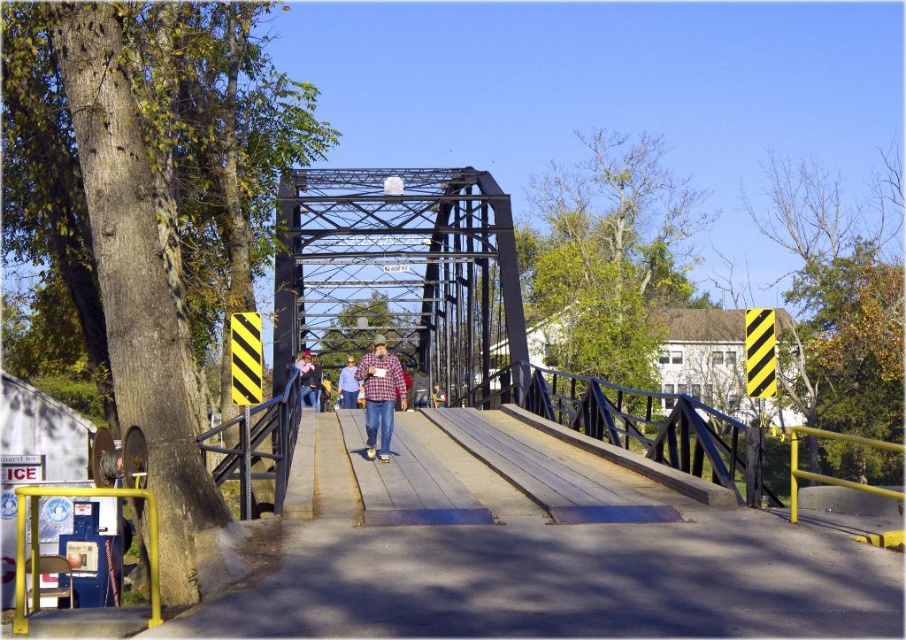
Question: Which object appears farthest from the camera in this image?

Choices:
 (A) matte pink shirt at center
 (B) plaid fabric shirt at center
 (C) black metal bridge at center
 (D) denim jacket at center

Answer: (A)

Question: Which object is positioned farthest from the denim jacket at center?

Choices:
 (A) matte pink shirt at center
 (B) black metal bridge at center
 (C) plaid fabric shirt at center

Answer: (B)

Question: Which object appears closest to the camera in this image?

Choices:
 (A) denim jacket at center
 (B) black metal bridge at center

Answer: (B)

Question: Does matte pink shirt at center have a greater width compared to denim jacket at center?

Choices:
 (A) no
 (B) yes

Answer: (A)

Question: Does black metal bridge at center come in front of plaid fabric shirt at center?

Choices:
 (A) yes
 (B) no

Answer: (B)

Question: Can you confirm if matte pink shirt at center is wider than denim jacket at center?

Choices:
 (A) yes
 (B) no

Answer: (B)